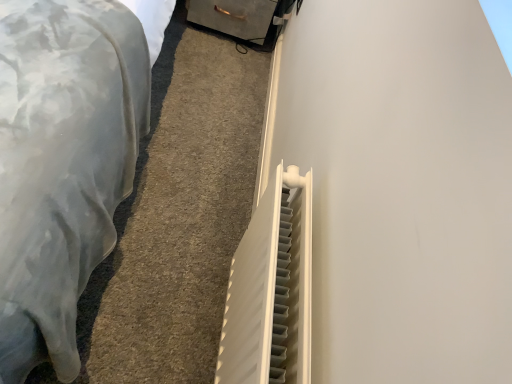
Question: Can you confirm if metallic gray drawer at upper center is bigger than white plastic radiator at lower right?

Choices:
 (A) no
 (B) yes

Answer: (B)

Question: Considering the relative sizes of metallic gray drawer at upper center and white plastic radiator at lower right in the image provided, is metallic gray drawer at upper center thinner than white plastic radiator at lower right?

Choices:
 (A) yes
 (B) no

Answer: (A)

Question: Is white plastic radiator at lower right surrounded by metallic gray drawer at upper center?

Choices:
 (A) no
 (B) yes

Answer: (A)

Question: Considering the relative sizes of metallic gray drawer at upper center and white plastic radiator at lower right in the image provided, is metallic gray drawer at upper center shorter than white plastic radiator at lower right?

Choices:
 (A) no
 (B) yes

Answer: (A)

Question: From a real-world perspective, is metallic gray drawer at upper center on white plastic radiator at lower right?

Choices:
 (A) no
 (B) yes

Answer: (B)

Question: From a real-world perspective, is white plastic radiator at center-right physically located above or below metallic gray drawer at upper center?

Choices:
 (A) above
 (B) below

Answer: (A)

Question: Based on their sizes in the image, would you say white plastic radiator at center-right is bigger or smaller than metallic gray drawer at upper center?

Choices:
 (A) big
 (B) small

Answer: (B)

Question: Would you say white plastic radiator at center-right is to the left or to the right of metallic gray drawer at upper center in the picture?

Choices:
 (A) right
 (B) left

Answer: (A)

Question: Considering the positions of white plastic radiator at center-right and metallic gray drawer at upper center in the image, is white plastic radiator at center-right wider or thinner than metallic gray drawer at upper center?

Choices:
 (A) thin
 (B) wide

Answer: (A)

Question: Is metallic gray drawer at upper center inside the boundaries of white plastic radiator at center-right, or outside?

Choices:
 (A) outside
 (B) inside

Answer: (A)

Question: Looking at their shapes, would you say metallic gray drawer at upper center is wider or thinner than white plastic radiator at center-right?

Choices:
 (A) wide
 (B) thin

Answer: (A)

Question: In the image, is metallic gray drawer at upper center on the left side or the right side of white plastic radiator at center-right?

Choices:
 (A) left
 (B) right

Answer: (A)

Question: Considering the positions of metallic gray drawer at upper center and white plastic radiator at center-right in the image, is metallic gray drawer at upper center taller or shorter than white plastic radiator at center-right?

Choices:
 (A) short
 (B) tall

Answer: (A)

Question: Is metallic gray drawer at upper center inside the boundaries of white plastic radiator at lower right, or outside?

Choices:
 (A) inside
 (B) outside

Answer: (B)

Question: In terms of height, does metallic gray drawer at upper center look taller or shorter compared to white plastic radiator at lower right?

Choices:
 (A) tall
 (B) short

Answer: (A)